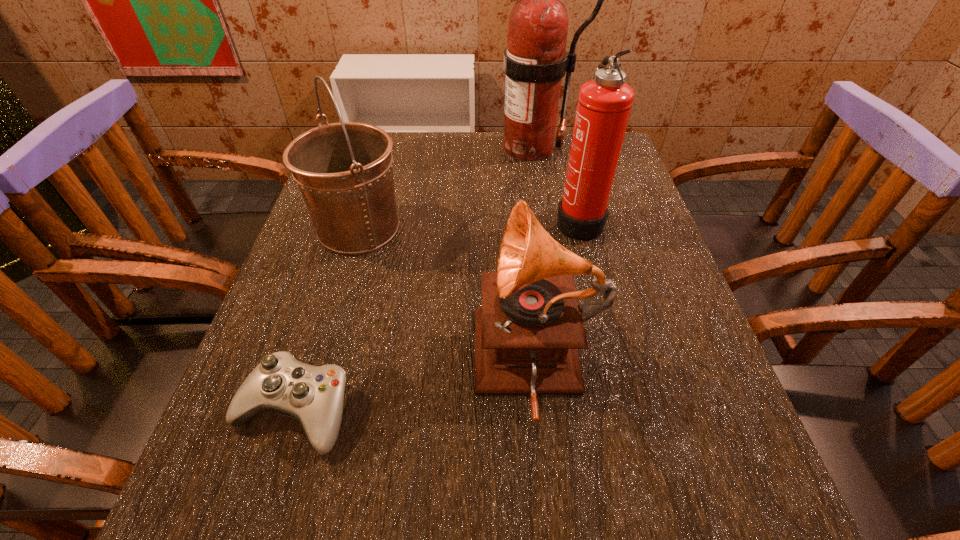
Find the location of a particular element. This screenshot has width=960, height=540. control positioned at the left edge is located at coordinates (313, 395).

Where is `object that is at the far right corner`? The image size is (960, 540). object that is at the far right corner is located at coordinates (535, 61).

The image size is (960, 540). Find the location of `vacant point at the far edge`. vacant point at the far edge is located at coordinates (410, 146).

Identify the location of vacant space at the near edge. (646, 496).

The image size is (960, 540). In the image, there is a desktop. Identify the location of free space at the left edge. (304, 435).

Locate an element on the screen. Image resolution: width=960 pixels, height=540 pixels. free spot at the right edge of the desktop is located at coordinates (612, 251).

In order to click on vacant space at the far right corner of the desktop in this screenshot , I will do `click(626, 166)`.

In order to click on vacant area that lies between the bucket and the shorter fire extinguisher in this screenshot , I will do `click(468, 224)`.

What are the coordinates of `vacant space in between the phonograph record and the bucket` in the screenshot? It's located at (448, 297).

Where is `vacant space that's between the bucket and the phonograph record`? vacant space that's between the bucket and the phonograph record is located at coordinates (448, 297).